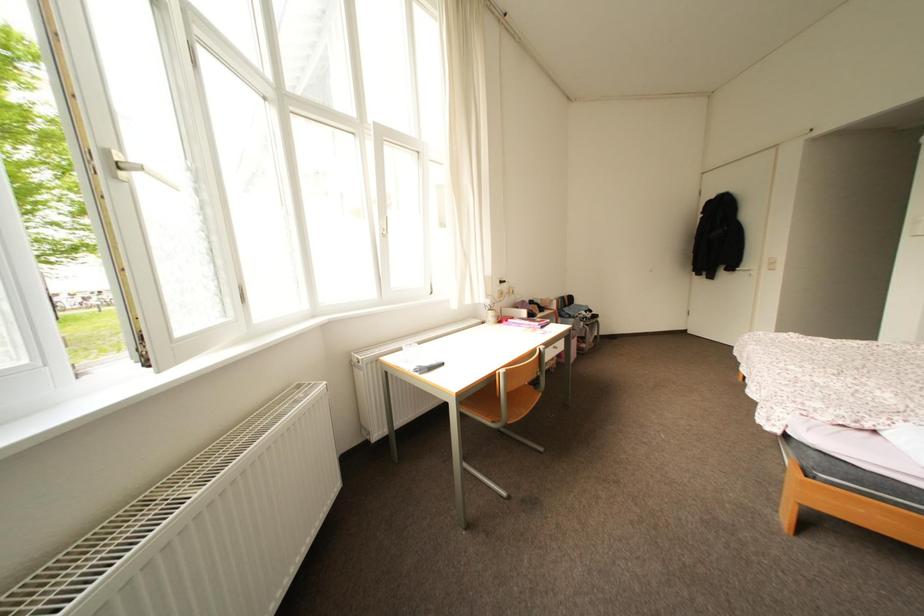
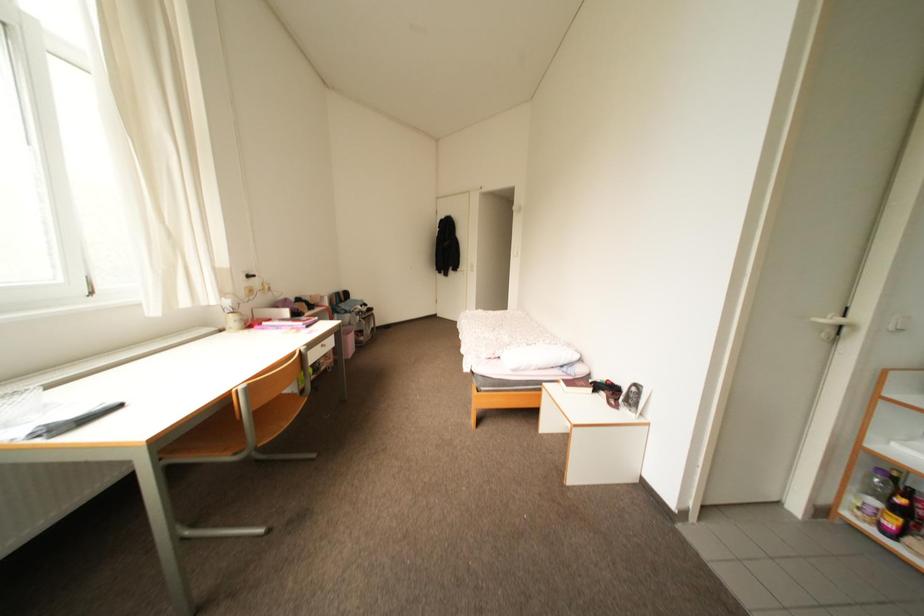
Question: The camera is either moving clockwise (left) or counter-clockwise (right) around the object. The first image is from the beginning of the video and the second image is from the end. Is the camera moving left or right when shooting the video?

Choices:
 (A) Left
 (B) Right

Answer: (A)